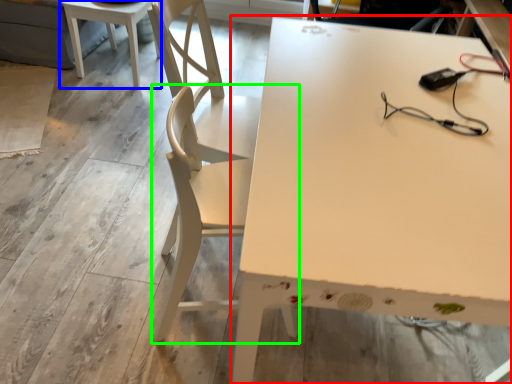
Question: Which is nearer to the table (highlighted by a red box)? table (highlighted by a blue box) or chair (highlighted by a green box).

Choices:
 (A) table
 (B) chair

Answer: (B)